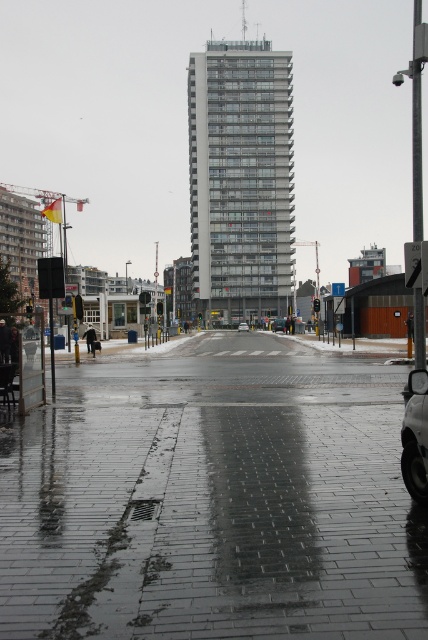
Is wet brick pavement at center thinner than shiny silver car at lower right?

No, wet brick pavement at center is not thinner than shiny silver car at lower right.

Is point (183, 572) positioned behind point (413, 397)?

That is False.

Between point (137, 627) and point (401, 467), which one is positioned in front?

Positioned in front is point (137, 627).

Image resolution: width=428 pixels, height=640 pixels. Find the location of `wet brick pavement at center`. wet brick pavement at center is located at coordinates (213, 500).

Who is shorter, wet brick pavement at center or gray concrete building at center?

Standing shorter between the two is wet brick pavement at center.

Does wet brick pavement at center have a lesser width compared to gray concrete building at center?

Indeed, wet brick pavement at center has a lesser width compared to gray concrete building at center.

Image resolution: width=428 pixels, height=640 pixels. What do you see at coordinates (213, 500) in the screenshot? I see `wet brick pavement at center` at bounding box center [213, 500].

Locate an element on the screen. This screenshot has width=428, height=640. wet brick pavement at center is located at coordinates (213, 500).

Does gray concrete building at center appear under silver metallic sedan at center?

Actually, gray concrete building at center is above silver metallic sedan at center.

Is gray concrete building at center wider than silver metallic sedan at center?

Correct, the width of gray concrete building at center exceeds that of silver metallic sedan at center.

You are a GUI agent. You are given a task and a screenshot of the screen. Output one action in this format:
    pyautogui.click(x=<x>, y=<y>)
    Task: Click on the gray concrete building at center
    
    Given the screenshot: What is the action you would take?
    pyautogui.click(x=240, y=179)